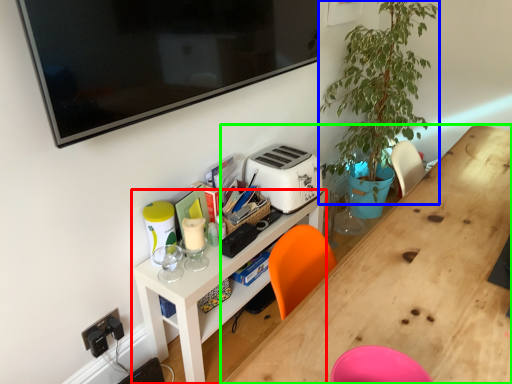
Question: Which object is positioned closest to shelf (highlighted by a red box)? Select from plant (highlighted by a blue box) and desk (highlighted by a green box).

Choices:
 (A) plant
 (B) desk

Answer: (B)